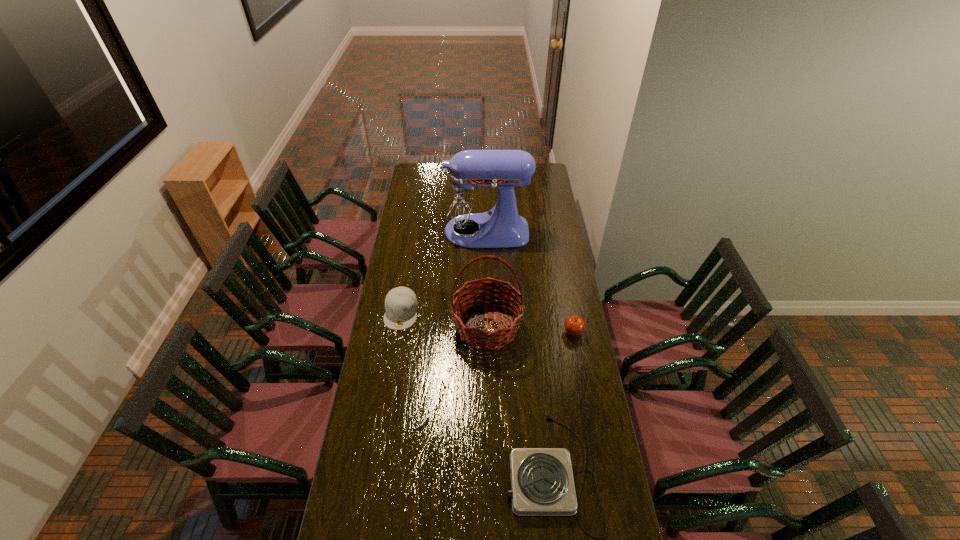
Identify which object is located as the third nearest to the nearest object. Please provide its 2D coordinates. Your answer should be formatted as a tuple, i.e. [(x, y)], where the tuple contains the x and y coordinates of a point satisfying the conditions above.

[(401, 304)]

This screenshot has width=960, height=540. I want to click on vacant region that satisfies the following two spatial constraints: 1. on the front-facing side of the leftmost object; 2. on the left side of the apple, so (x=397, y=333).

This screenshot has height=540, width=960. Identify the location of vacant space that satisfies the following two spatial constraints: 1. on the front-facing side of the apple; 2. on the right side of the cap. (397, 333).